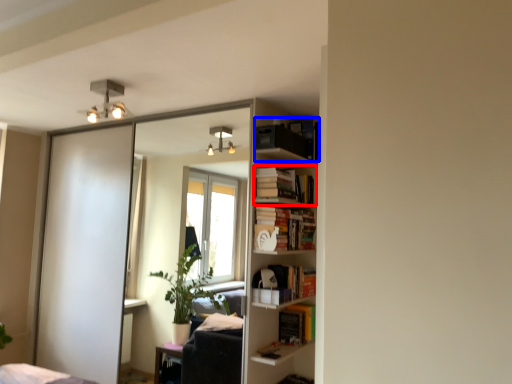
Question: Which object is further to the camera taking this photo, book (highlighted by a red box) or book (highlighted by a blue box)?

Choices:
 (A) book
 (B) book

Answer: (A)